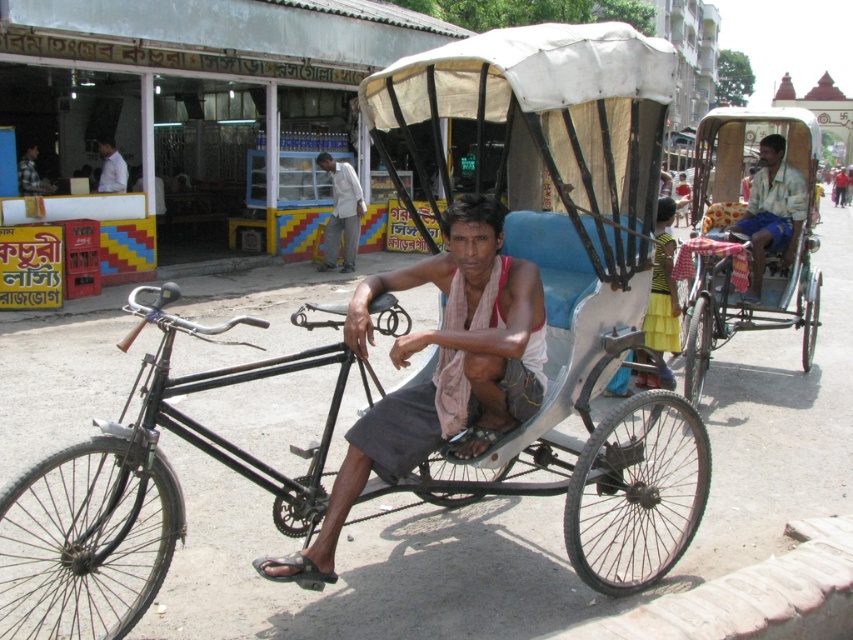
Does matte pink scarf at center appear on the right side of white shirt at upper left?

Indeed, matte pink scarf at center is positioned on the right side of white shirt at upper left.

Measure the distance between point (x=469, y=196) and camera.

Point (x=469, y=196) is 3.55 meters away from camera.

This screenshot has height=640, width=853. I want to click on matte pink scarf at center, so click(438, 371).

Is white fabric rickshaw at center below white shirt at upper left?

Yes, white fabric rickshaw at center is below white shirt at upper left.

Is white fabric rickshaw at center thinner than white shirt at upper left?

No, white fabric rickshaw at center is not thinner than white shirt at upper left.

Where is `white fabric rickshaw at center`? white fabric rickshaw at center is located at coordinates (573, 272).

Between point (502, 285) and point (358, 221), which one is positioned behind?

Point (358, 221)

Does matte pink scarf at center have a lesser height compared to light gray fabric shirt at center?

Yes.

Image resolution: width=853 pixels, height=640 pixels. In order to click on matte pink scarf at center in this screenshot , I will do (438, 371).

Image resolution: width=853 pixels, height=640 pixels. Find the location of `matte pink scarf at center`. matte pink scarf at center is located at coordinates (438, 371).